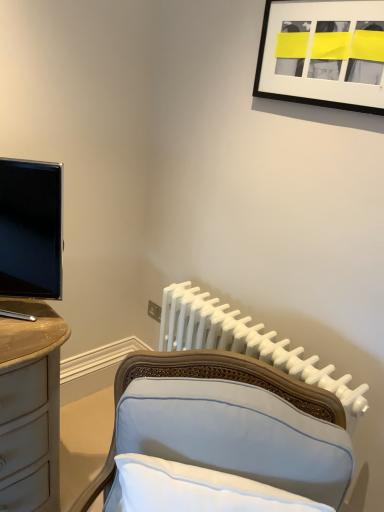
Image resolution: width=384 pixels, height=512 pixels. Describe the element at coordinates (227, 423) in the screenshot. I see `light blue fabric chair at lower center` at that location.

At what (x,y) coordinates should I click in order to perform the action: click on white plastic radiator at center. Please return your answer as a coordinate pair (x, y). Looking at the image, I should click on (246, 343).

From a real-world perspective, which is physically below, light blue fabric chair at lower center or matte black tv at left?

light blue fabric chair at lower center is physically lower.

Is point (127, 401) closer or farther from the camera than point (5, 280)?

Point (127, 401).

Based on the photo, considering the sizes of objects light blue fabric chair at lower center and matte black tv at left in the image provided, who is taller, light blue fabric chair at lower center or matte black tv at left?

matte black tv at left.

This screenshot has height=512, width=384. I want to click on television lying above the light blue fabric chair at lower center (from the image's perspective), so click(30, 229).

Is white plastic radiator at center bigger or smaller than black matte picture frame at upper right?

In the image, white plastic radiator at center appears to be larger than black matte picture frame at upper right.

Which of these two, white plastic radiator at center or black matte picture frame at upper right, is thinner?

black matte picture frame at upper right.

How different are the orientations of white plastic radiator at center and black matte picture frame at upper right in degrees?

The angular difference between white plastic radiator at center and black matte picture frame at upper right is 0.164 degrees.

Considering their positions, is white plastic radiator at center located in front of or behind light blue fabric chair at lower center?

white plastic radiator at center is behind light blue fabric chair at lower center.

The image size is (384, 512). Find the location of `furniture that is below the white plastic radiator at center (from the image's perspective)`. furniture that is below the white plastic radiator at center (from the image's perspective) is located at coordinates (227, 423).

Is white plastic radiator at center not within light blue fabric chair at lower center?

Yes.

Which of these two, white plastic radiator at center or light blue fabric chair at lower center, is bigger?

white plastic radiator at center is bigger.

Between matte black tv at left and black matte picture frame at upper right, which one has more height?

matte black tv at left.

Is matte black tv at left placed right next to black matte picture frame at upper right?

No, matte black tv at left is not in contact with black matte picture frame at upper right.

Are light blue fabric chair at lower center and black matte picture frame at upper right located far from each other?

No, light blue fabric chair at lower center is in close proximity to black matte picture frame at upper right.

From the image's perspective, is light blue fabric chair at lower center located above or below black matte picture frame at upper right?

light blue fabric chair at lower center is below black matte picture frame at upper right.

From the picture: From a real-world perspective, who is located lower, matte black tv at left or white plastic radiator at center?

white plastic radiator at center is physically lower.

Looking at this image, from the image's perspective, which is below, matte black tv at left or white plastic radiator at center?

white plastic radiator at center, from the image's perspective.

Locate an element on the screen. The image size is (384, 512). radiator below the matte black tv at left (from a real-world perspective) is located at coordinates (246, 343).

Is matte black tv at left at the right side of white plastic radiator at center?

No.

In terms of size, does black matte picture frame at upper right appear bigger or smaller than light blue fabric chair at lower center?

Considering their sizes, black matte picture frame at upper right takes up less space than light blue fabric chair at lower center.

Is point (359, 19) behind point (161, 413)?

Yes, point (359, 19) is farther from viewer.

Does black matte picture frame at upper right contain light blue fabric chair at lower center?

No, light blue fabric chair at lower center is not inside black matte picture frame at upper right.

From the picture: From a real-world perspective, between black matte picture frame at upper right and light blue fabric chair at lower center, who is vertically lower?

From a 3D spatial view, light blue fabric chair at lower center is below.

Locate an element on the screen. The image size is (384, 512). furniture that appears below the matte black tv at left (from a real-world perspective) is located at coordinates (227, 423).

The height and width of the screenshot is (512, 384). In order to click on radiator behind the black matte picture frame at upper right in this screenshot , I will do `click(246, 343)`.

Estimate the real-world distances between objects in this image. Which object is further from white plastic radiator at center, light blue fabric chair at lower center or matte black tv at left?

matte black tv at left lies further to white plastic radiator at center than the other object.

Looking at the image, which one is located further to light blue fabric chair at lower center, black matte picture frame at upper right or matte black tv at left?

black matte picture frame at upper right is positioned further to the anchor light blue fabric chair at lower center.

Looking at the image, which one is located further to light blue fabric chair at lower center, white plastic radiator at center or black matte picture frame at upper right?

black matte picture frame at upper right is further to light blue fabric chair at lower center.

Based on their spatial positions, is black matte picture frame at upper right or white plastic radiator at center closer to light blue fabric chair at lower center?

The object closer to light blue fabric chair at lower center is white plastic radiator at center.

Estimate the real-world distances between objects in this image. Which object is further from white plastic radiator at center, matte black tv at left or light blue fabric chair at lower center?

The object further to white plastic radiator at center is matte black tv at left.

From the image, which object appears to be nearer to matte black tv at left, black matte picture frame at upper right or white plastic radiator at center?

white plastic radiator at center is positioned closer to the anchor matte black tv at left.

Estimate the real-world distances between objects in this image. Which object is closer to white plastic radiator at center, black matte picture frame at upper right or matte black tv at left?

Based on the image, matte black tv at left appears to be nearer to white plastic radiator at center.

Considering their positions, is light blue fabric chair at lower center positioned closer to matte black tv at left than white plastic radiator at center?

light blue fabric chair at lower center is positioned closer to the anchor matte black tv at left.

Image resolution: width=384 pixels, height=512 pixels. Identify the location of furniture situated between matte black tv at left and white plastic radiator at center from left to right. (227, 423).

Locate an element on the screen. radiator that lies between black matte picture frame at upper right and light blue fabric chair at lower center from top to bottom is located at coordinates [x=246, y=343].

Identify the location of television between black matte picture frame at upper right and light blue fabric chair at lower center in the vertical direction. This screenshot has width=384, height=512. click(30, 229).

Locate an element on the screen. The height and width of the screenshot is (512, 384). television between black matte picture frame at upper right and white plastic radiator at center in the up-down direction is located at coordinates (30, 229).